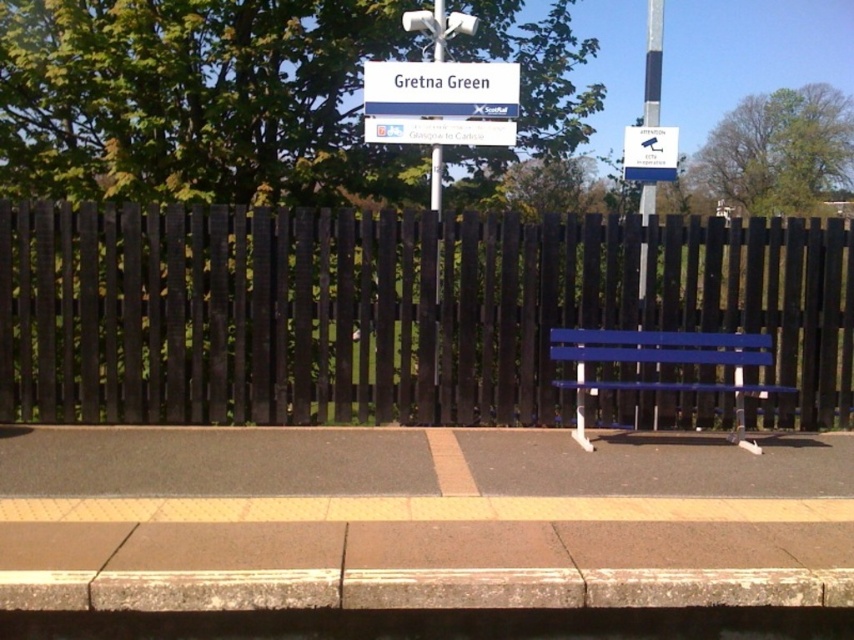
Does dark brown wooden fence at center appear under blue painted wood bench at center?

No, dark brown wooden fence at center is not below blue painted wood bench at center.

Which is behind, point (471, 328) or point (566, 385)?

The point (471, 328) is more distant.

Find the location of a particular element. This screenshot has width=854, height=640. dark brown wooden fence at center is located at coordinates click(x=389, y=310).

Which is below, blue painted wood bench at center or blue painted metal pole at center?

blue painted wood bench at center

Measure the distance between blue painted wood bench at center and blue painted metal pole at center.

blue painted wood bench at center and blue painted metal pole at center are 38.46 inches apart from each other.

Is point (764, 358) positioned behind point (647, 186)?

No, (764, 358) is closer to viewer.

Locate an element on the screen. blue painted wood bench at center is located at coordinates (664, 364).

Does point (648, 340) lie in front of point (405, 67)?

Yes, point (648, 340) is in front of point (405, 67).

Can you confirm if blue painted wood bench at center is thinner than blue plastic sign at center?

No.

Locate an element on the screen. This screenshot has height=640, width=854. blue painted wood bench at center is located at coordinates (664, 364).